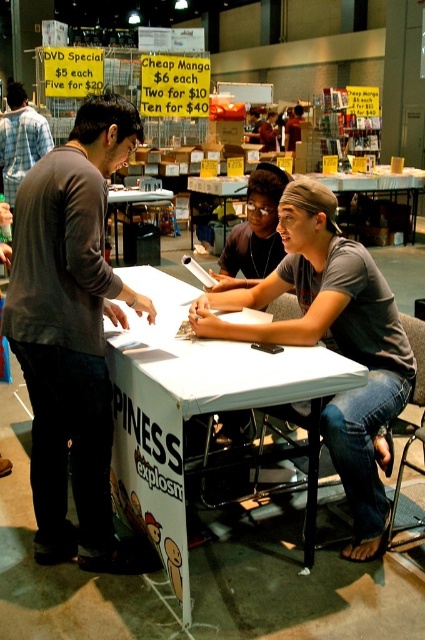
Who is shorter, dark gray long-sleeve shirt at left or matte gray shirt at center?

matte gray shirt at center

This screenshot has height=640, width=425. I want to click on dark gray long-sleeve shirt at left, so click(x=73, y=336).

This screenshot has height=640, width=425. Identify the location of dark gray long-sleeve shirt at left. (73, 336).

Based on the photo, is dark gray long-sleeve shirt at left above plaid shirt at left?

No.

Which of these two, dark gray long-sleeve shirt at left or plaid shirt at left, stands shorter?

Standing shorter between the two is plaid shirt at left.

I want to click on dark gray long-sleeve shirt at left, so click(73, 336).

Locate an element on the screen. Image resolution: width=425 pixels, height=640 pixels. dark gray long-sleeve shirt at left is located at coordinates (73, 336).

Who is higher up, dark gray long-sleeve shirt at left or white paper at center?

dark gray long-sleeve shirt at left

Between dark gray long-sleeve shirt at left and white paper at center, which one has less height?

white paper at center is shorter.

What do you see at coordinates (73, 336) in the screenshot? The image size is (425, 640). I see `dark gray long-sleeve shirt at left` at bounding box center [73, 336].

At what (x,y) coordinates should I click in order to perform the action: click on dark gray long-sleeve shirt at left. Please return your answer as a coordinate pair (x, y). Image resolution: width=425 pixels, height=640 pixels. Looking at the image, I should click on (73, 336).